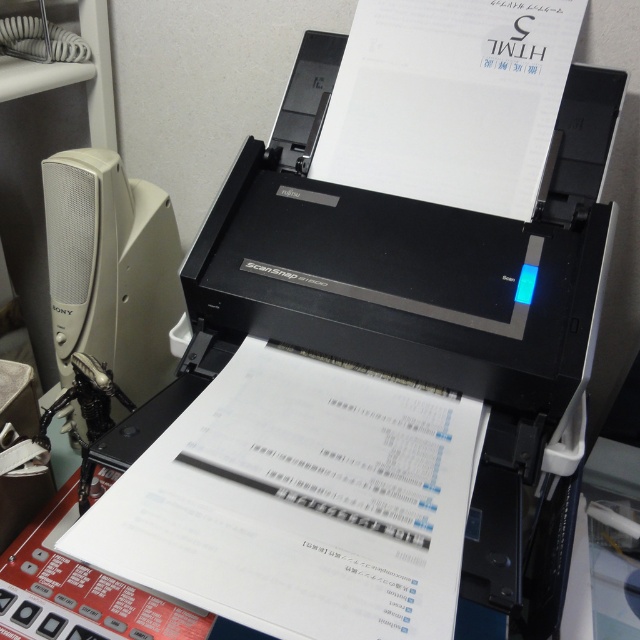
You are organizing items on a desk and need to place a new item between the white paper at upper center and the white plastic speaker at left. Based on their positions, which item is closer to you so you can place the new item appropriately?

The white paper at upper center is closer to the viewer than the white plastic speaker at left, so place the new item between them by positioning it closer to the white plastic speaker at left.